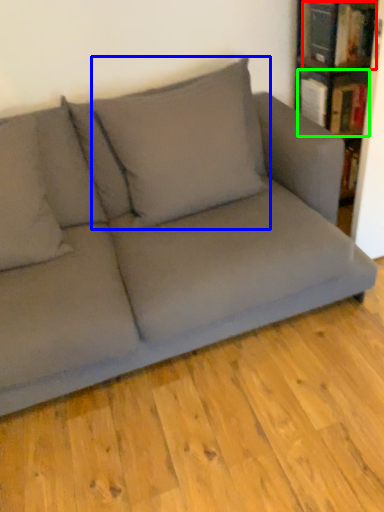
Question: Estimate the real-world distances between objects in this image. Which object is closer to book (highlighted by a red box), pillow (highlighted by a blue box) or book (highlighted by a green box)?

Choices:
 (A) pillow
 (B) book

Answer: (B)